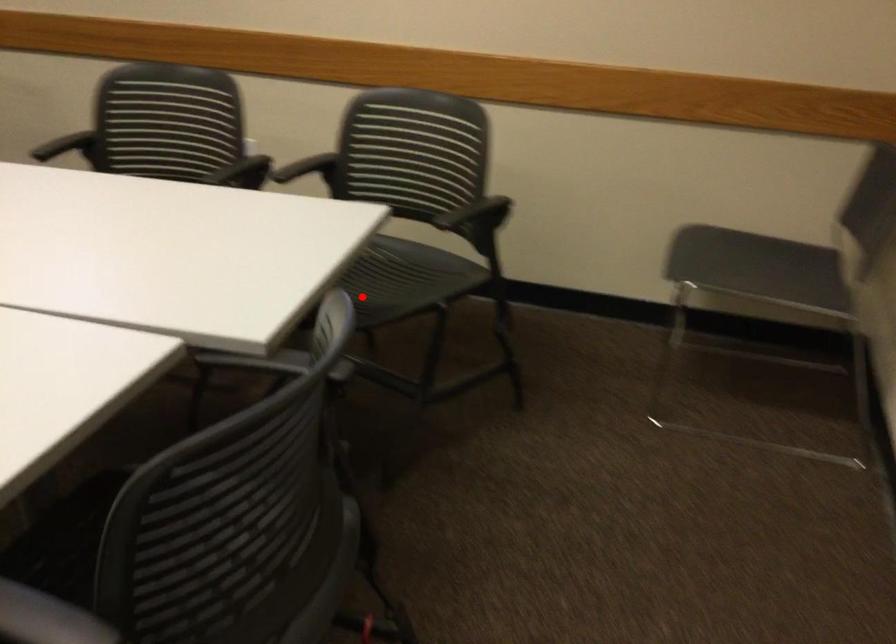
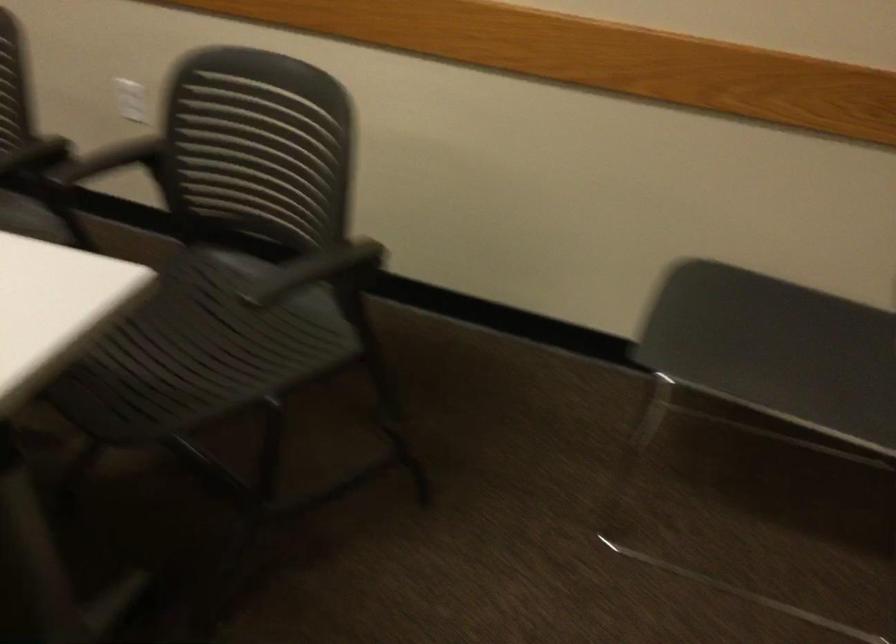
Find the pixel in the second image that matches the highlighted location in the first image.

(179, 365)